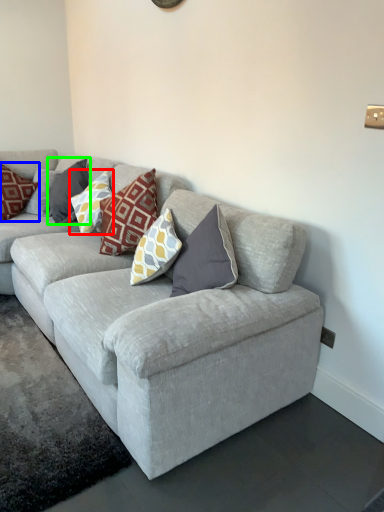
Question: Estimate the real-world distances between objects in this image. Which object is farther from pillow (highlighted by a red box), pillow (highlighted by a blue box) or pillow (highlighted by a green box)?

Choices:
 (A) pillow
 (B) pillow

Answer: (A)